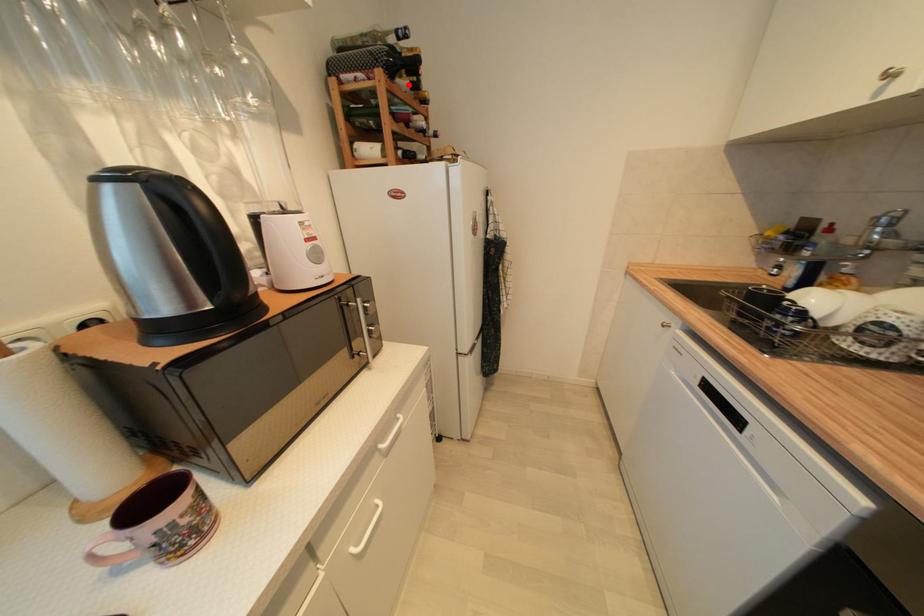
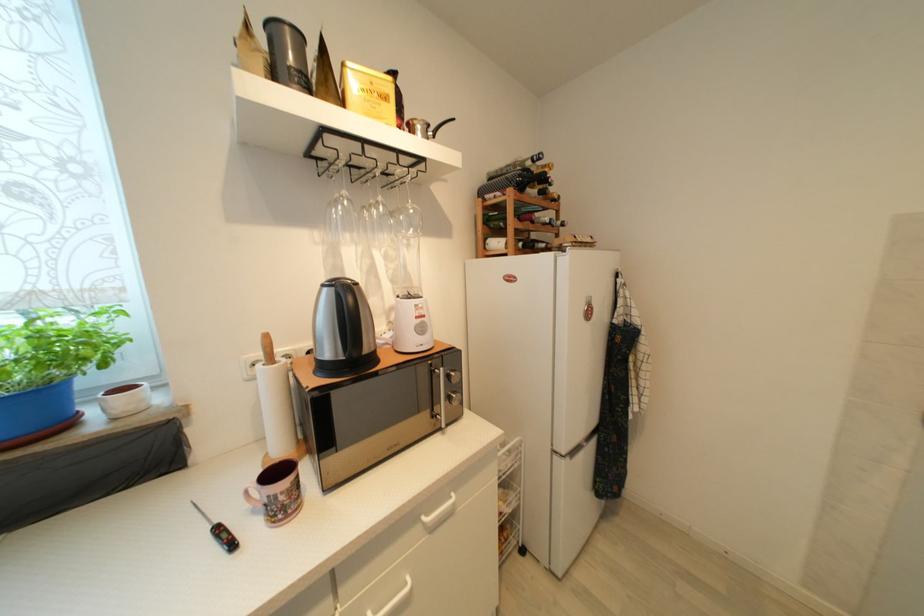
In the second image, find the point that corresponds to the highlighted location in the first image.

(538, 193)